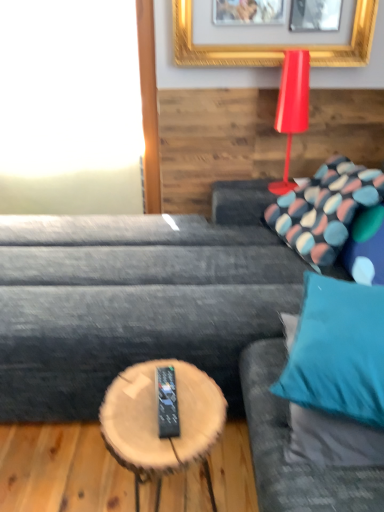
Question: From the image's perspective, is wooden log coffee table at center below dark gray fabric couch at center?

Choices:
 (A) no
 (B) yes

Answer: (B)

Question: Can you confirm if wooden log coffee table at center is taller than dark gray fabric couch at center?

Choices:
 (A) yes
 (B) no

Answer: (B)

Question: Is the depth of wooden log coffee table at center less than that of dark gray fabric couch at center?

Choices:
 (A) yes
 (B) no

Answer: (A)

Question: Would you say dark gray fabric couch at center is part of wooden log coffee table at center's contents?

Choices:
 (A) no
 (B) yes

Answer: (A)

Question: Is wooden log coffee table at center to the right of dark gray fabric couch at center from the viewer's perspective?

Choices:
 (A) yes
 (B) no

Answer: (B)

Question: Is patterned fabric pillow at upper right, the 1th pillow viewed from the top, situated inside teal fabric couch at right or outside?

Choices:
 (A) inside
 (B) outside

Answer: (B)

Question: From the image's perspective, relative to teal fabric couch at right, is patterned fabric pillow at upper right, the 2th pillow from the front, above or below?

Choices:
 (A) below
 (B) above

Answer: (B)

Question: Is patterned fabric pillow at upper right, the second pillow when ordered from bottom to top, wider or thinner than teal fabric couch at right?

Choices:
 (A) wide
 (B) thin

Answer: (B)

Question: From a real-world perspective, is patterned fabric pillow at upper right, the 1th pillow viewed from the top, above or below teal fabric couch at right?

Choices:
 (A) above
 (B) below

Answer: (A)

Question: In the image, is teal fabric pillow at right, the 2th pillow when ordered from back to front, positioned in front of or behind white glass window at upper left?

Choices:
 (A) front
 (B) behind

Answer: (A)

Question: Is teal fabric pillow at right, the 1th pillow ordered from the bottom, wider or thinner than white glass window at upper left?

Choices:
 (A) wide
 (B) thin

Answer: (A)

Question: Does point (362, 377) appear closer or farther from the camera than point (96, 116)?

Choices:
 (A) closer
 (B) farther

Answer: (A)

Question: From the image's perspective, is teal fabric pillow at right, positioned as the 1th pillow in front-to-back order, above or below white glass window at upper left?

Choices:
 (A) above
 (B) below

Answer: (B)

Question: From a real-world perspective, is patterned fabric pillow at upper right, the second pillow when ordered from bottom to top, physically located above or below wooden log coffee table at center?

Choices:
 (A) below
 (B) above

Answer: (B)

Question: Visually, is patterned fabric pillow at upper right, the 2th pillow from the front, positioned to the left or to the right of wooden log coffee table at center?

Choices:
 (A) right
 (B) left

Answer: (A)